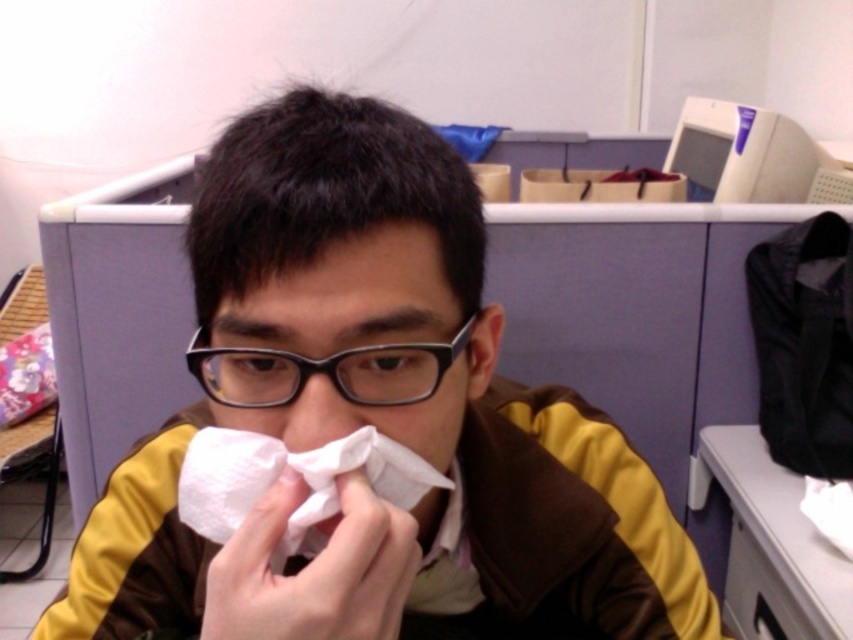
Question: Does brown/yellow fabric jacket at center appear under black plastic glasses at center?

Choices:
 (A) no
 (B) yes

Answer: (B)

Question: Does white paper handkerchief at center appear on the right side of black plastic glasses at center?

Choices:
 (A) yes
 (B) no

Answer: (A)

Question: Which is nearer to the white paper handkerchief at center?

Choices:
 (A) black plastic glasses at center
 (B) brown/yellow fabric jacket at center

Answer: (A)

Question: Observing the image, what is the correct spatial positioning of white paper handkerchief at center in reference to black plastic glasses at center?

Choices:
 (A) left
 (B) right

Answer: (B)

Question: Among these points, which one is nearest to the camera?

Choices:
 (A) (425, 486)
 (B) (273, 323)
 (C) (234, 353)

Answer: (B)

Question: Based on their relative distances, which object is nearer to the brown/yellow fabric jacket at center?

Choices:
 (A) white paper handkerchief at center
 (B) black plastic glasses at center

Answer: (A)